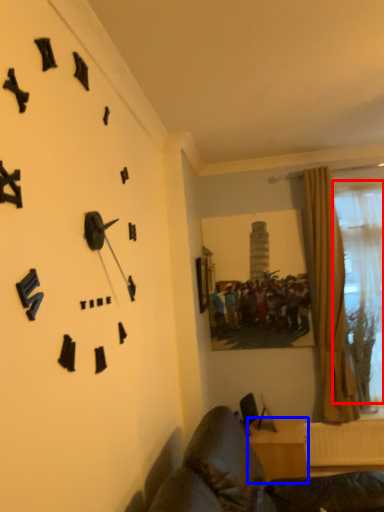
Question: Which object appears closest to the camera in this image, bay window (highlighted by a red box) or furniture (highlighted by a blue box)?

Choices:
 (A) bay window
 (B) furniture

Answer: (B)